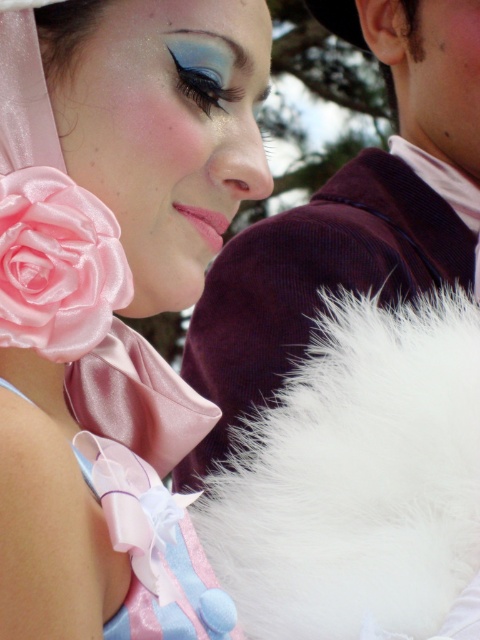
Based on the photo, you are a photographer setting up for a formal event. You have to position a velvet maroon coat at upper right and a satin rose at left in the frame. Given their sizes, which object should you place closer to the camera to maintain balance in the composition?

The velvet maroon coat at upper right is larger in size than the satin rose at left, so to maintain balance in the composition, you should place the smaller satin rose at left closer to the camera while positioning the larger velvet maroon coat at upper right farther back.

You are a photographer standing at a distance of 30 inches from the scene. You want to capture a closeup shot of the satin pink rose at upper left. Is the current distance sufficient to focus on the rose without moving closer?

The satin pink rose at upper left is 25.80 inches away from the viewer. Since the photographer is standing 30 inches away, which is farther than the required distance, moving closer to 25.80 inches would be needed to focus properly on the rose.

You are a photographer adjusting your camera settings to focus on both the velvet maroon coat at upper right and the satin rose at left. Which object should you focus on first to ensure both are in sharp focus?

The velvet maroon coat at upper right is closer to the viewer than the satin rose at left. To ensure both are in sharp focus, you should focus on the velvet maroon coat at upper right first, as it is the closer object.